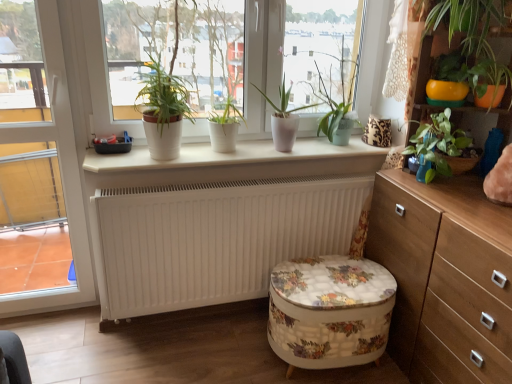
In order to click on blank space situated above white matte radiator at center (from a real-world perspective) in this screenshot , I will do `click(250, 177)`.